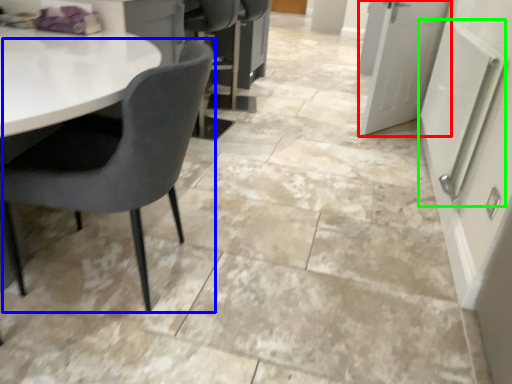
Question: Which is farther away from door (highlighted by a red box)? chair (highlighted by a blue box) or radiator (highlighted by a green box)?

Choices:
 (A) chair
 (B) radiator

Answer: (A)